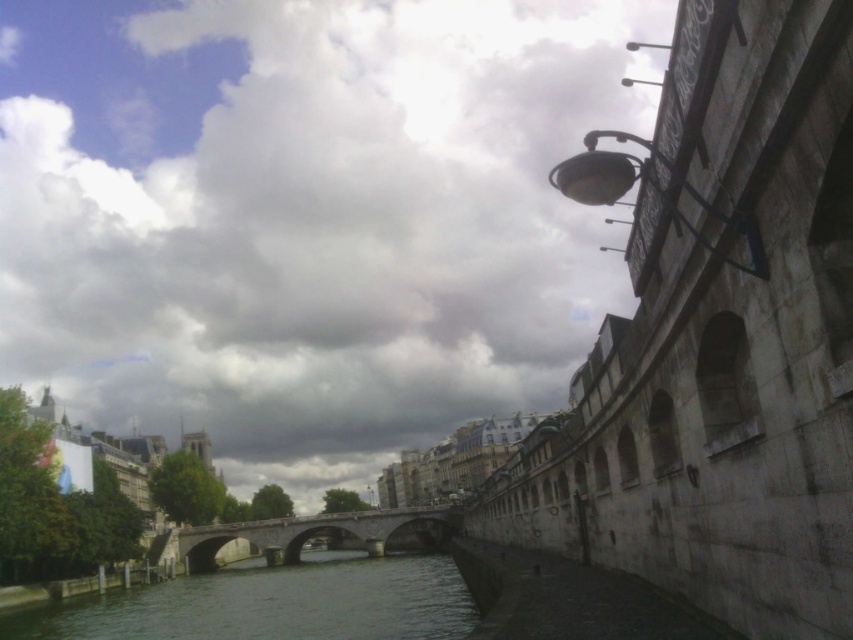
Question: Based on their relative distances, which object is nearer to the cloudy sky at upper center?

Choices:
 (A) greenish-gray water at center
 (B) stone bridge at center

Answer: (B)

Question: Which point is farther to the camera?

Choices:
 (A) cloudy sky at upper center
 (B) greenish-gray water at center

Answer: (A)

Question: Where is greenish-gray water at center located in relation to stone bridge at center in the image?

Choices:
 (A) below
 (B) above

Answer: (B)

Question: Which point is closer to the camera?

Choices:
 (A) (412, 630)
 (B) (97, 237)

Answer: (A)

Question: Is cloudy sky at upper center below greenish-gray water at center?

Choices:
 (A) no
 (B) yes

Answer: (A)

Question: Is cloudy sky at upper center thinner than stone bridge at center?

Choices:
 (A) no
 (B) yes

Answer: (A)